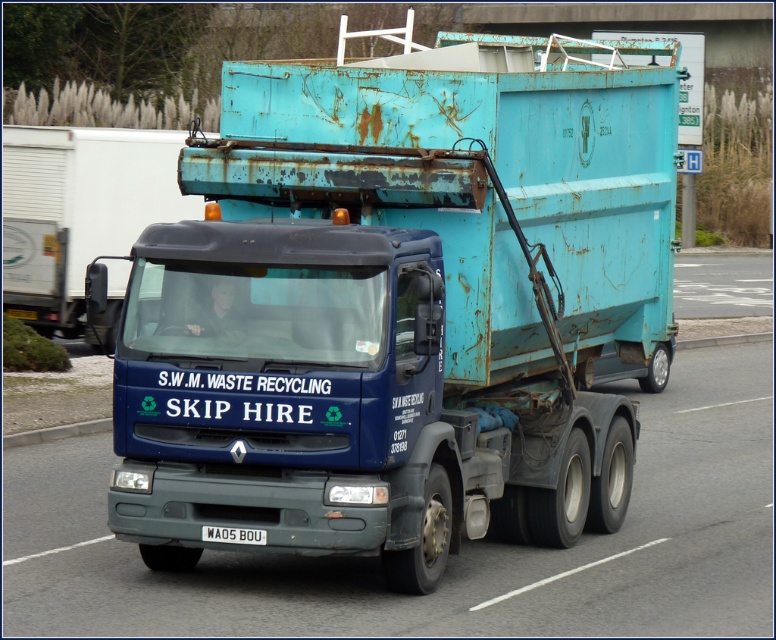
Question: Can you confirm if rusty metal skip at center is positioned to the right of blue metallic skip at center?

Choices:
 (A) no
 (B) yes

Answer: (B)

Question: Which of the following is the closest to the observer?

Choices:
 (A) blue metallic skip at center
 (B) rusty metal skip at center

Answer: (B)

Question: Observing the image, what is the correct spatial positioning of rusty metal skip at center in reference to white plastic license plate at center?

Choices:
 (A) right
 (B) left

Answer: (B)

Question: Which object is closer to the camera taking this photo?

Choices:
 (A) rusty metal skip at center
 (B) white plastic license plate at center

Answer: (A)

Question: Does rusty metal skip at center have a greater width compared to white plastic license plate at center?

Choices:
 (A) yes
 (B) no

Answer: (A)

Question: Estimate the real-world distances between objects in this image. Which object is farther from the rusty metal skip at center?

Choices:
 (A) blue metallic skip at center
 (B) white plastic license plate at center

Answer: (A)